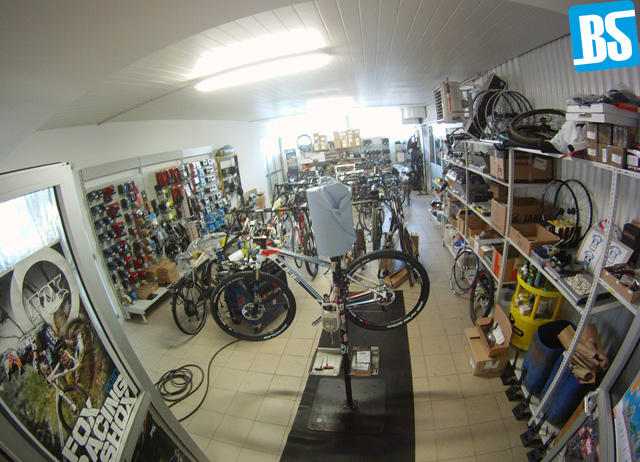
Identify the location of mat. Image resolution: width=640 pixels, height=462 pixels. (397, 411).